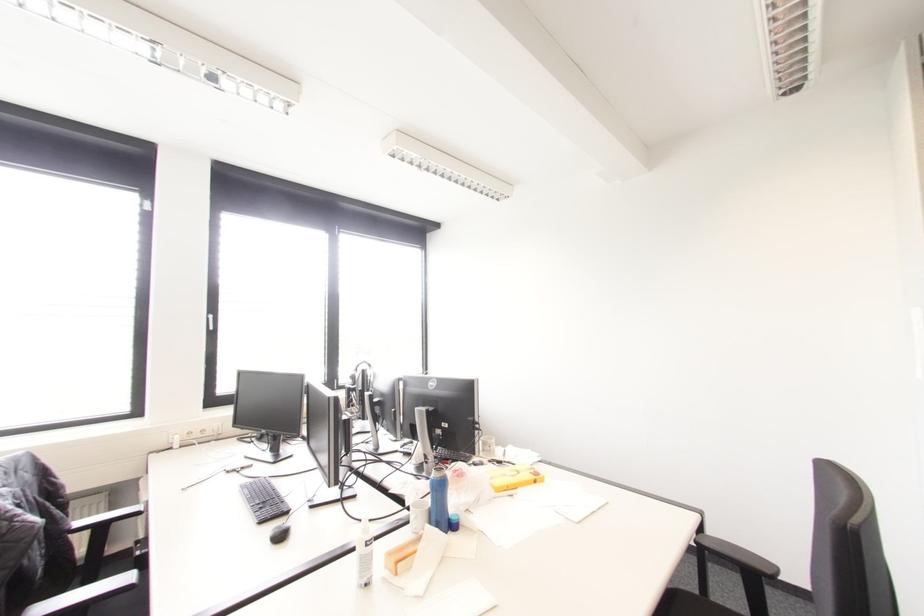
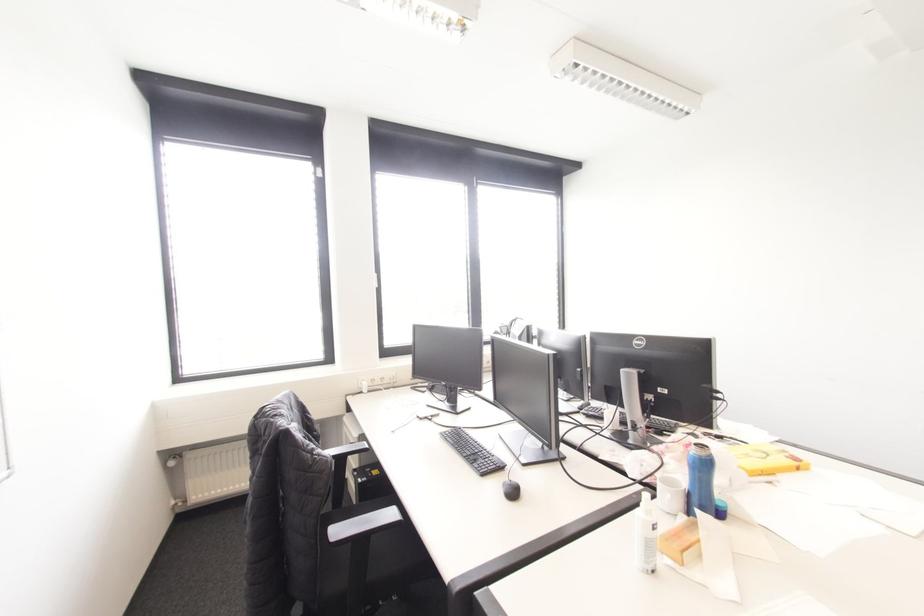
Question: How did the camera likely rotate?

Choices:
 (A) Left
 (B) Right
 (C) Up
 (D) Down

Answer: (A)